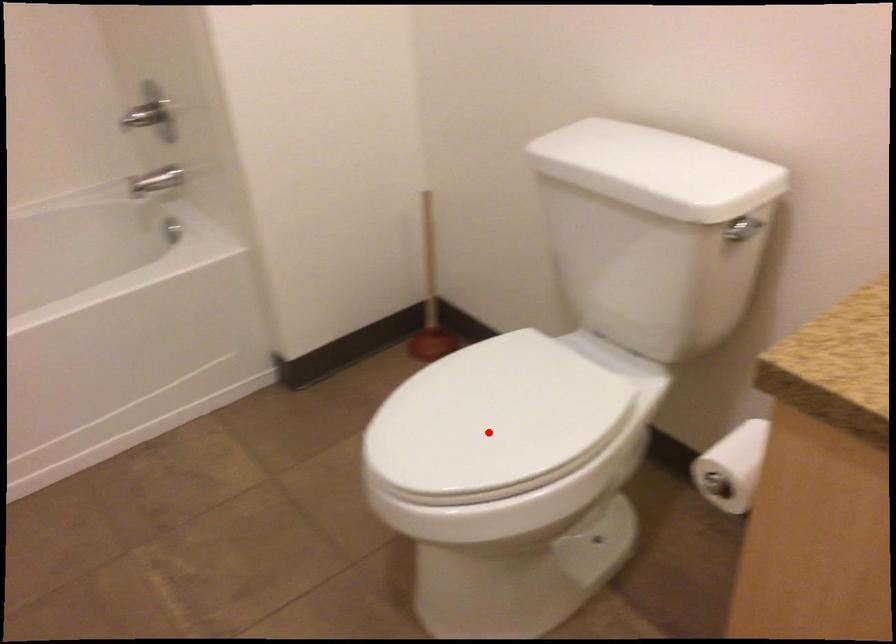
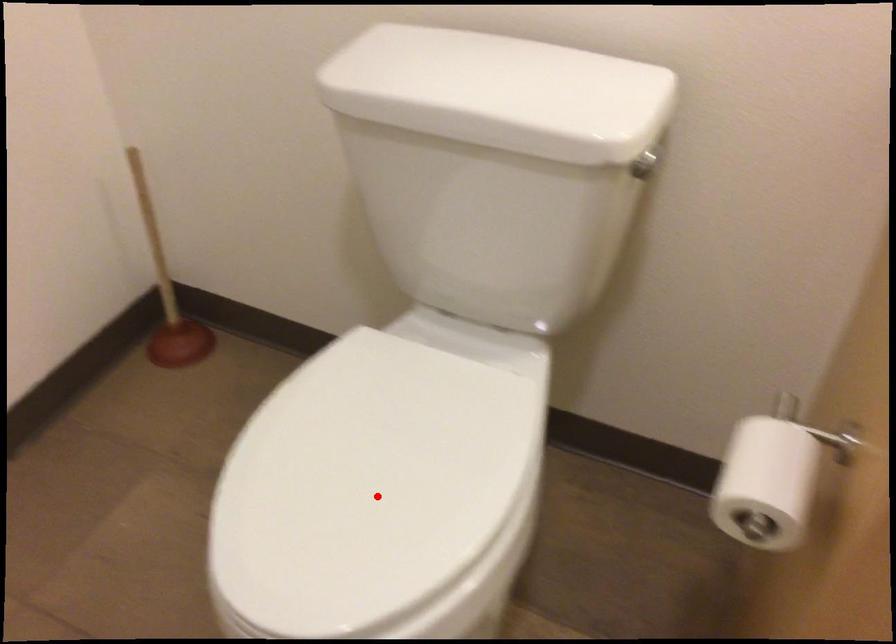
I am providing you with two images of the same scene from different viewpoints. A red point is marked on the first image and another point is marked on the second image. Is the marked point in image1 the same physical position as the marked point in image2?

Yes